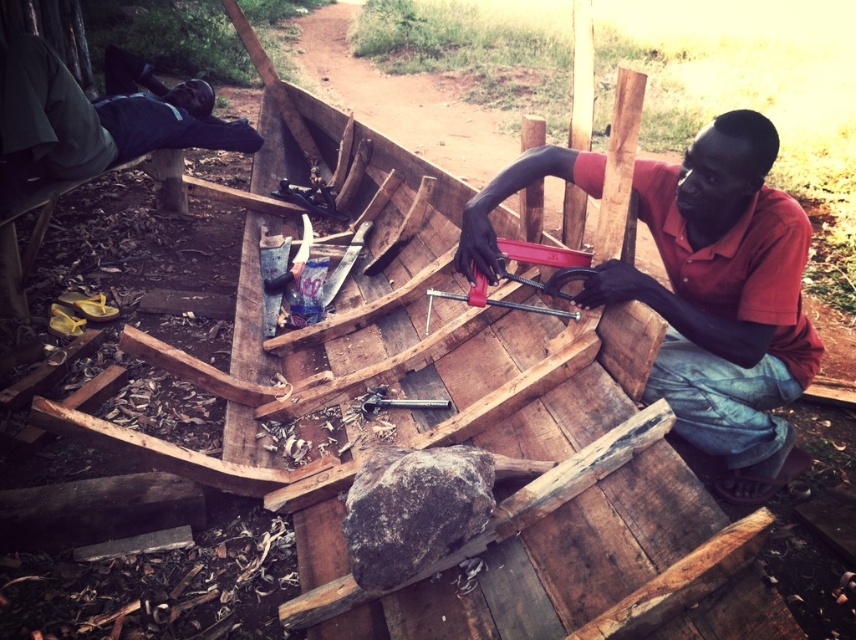
You are an observer standing in front of the boat construction scene. You notice the green fabric shirt at upper left and the metallic red clamp at center. Which object is positioned higher up in the image?

The green fabric shirt at upper left is taller than the metallic red clamp at center, so the green fabric shirt at upper left is positioned higher up in the image.